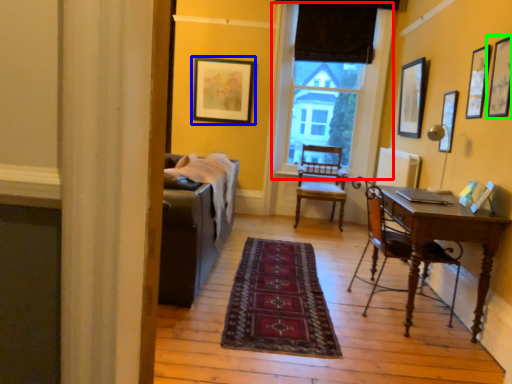
Question: Which object is positioned farthest from window (highlighted by a red box)? Select from picture frame (highlighted by a blue box) and picture frame (highlighted by a green box).

Choices:
 (A) picture frame
 (B) picture frame

Answer: (B)